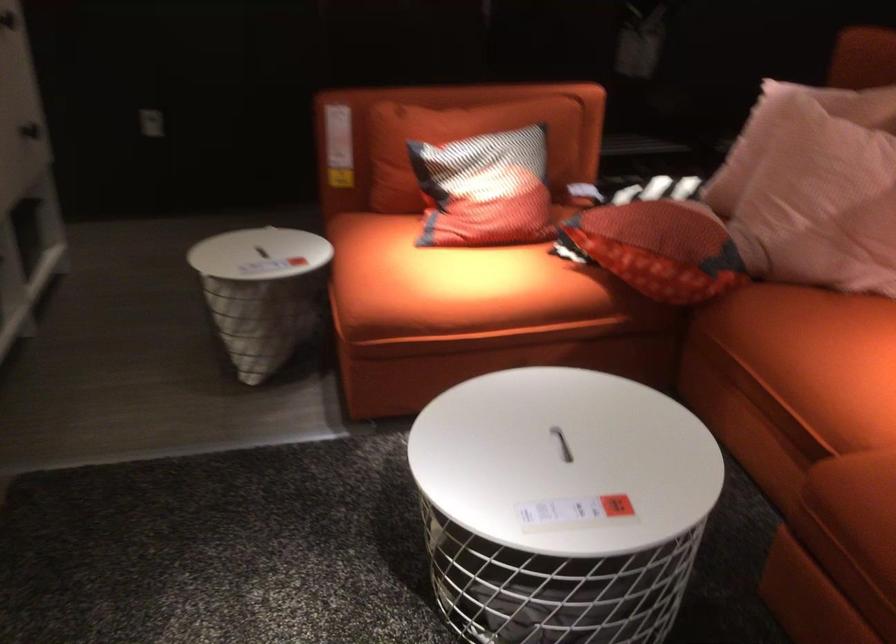
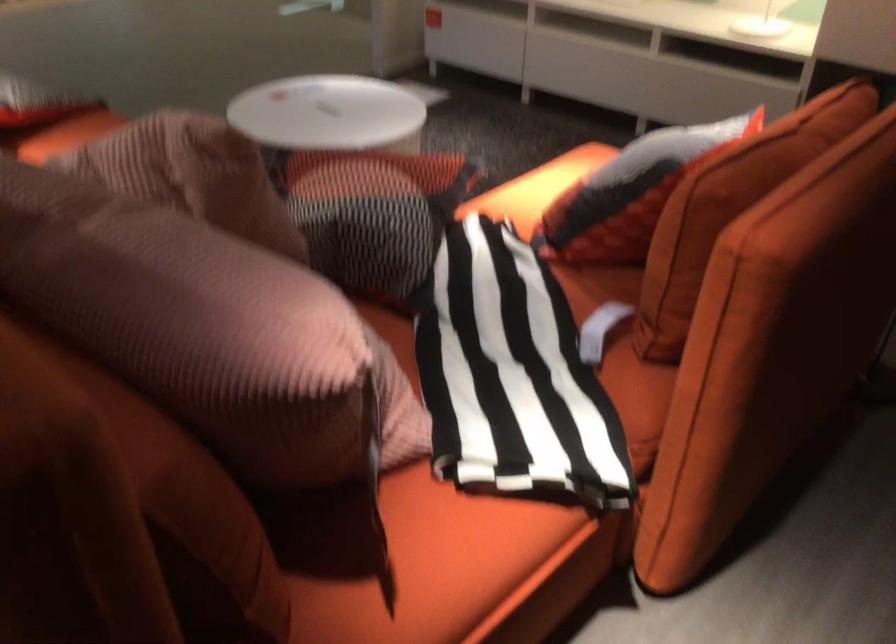
Question: I am providing you with two images of the same scene from different viewpoints. Which of the following objects are not visible in image2?

Choices:
 (A) pink ribbed pillow
 (B) sofa armrest
 (C) light pink pillow
 (D) white office printer

Answer: (C)